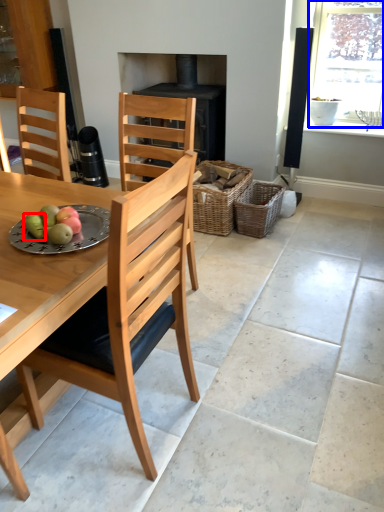
Question: Which of the following is the closest to the observer, fruit (highlighted by a red box) or window (highlighted by a blue box)?

Choices:
 (A) fruit
 (B) window

Answer: (A)